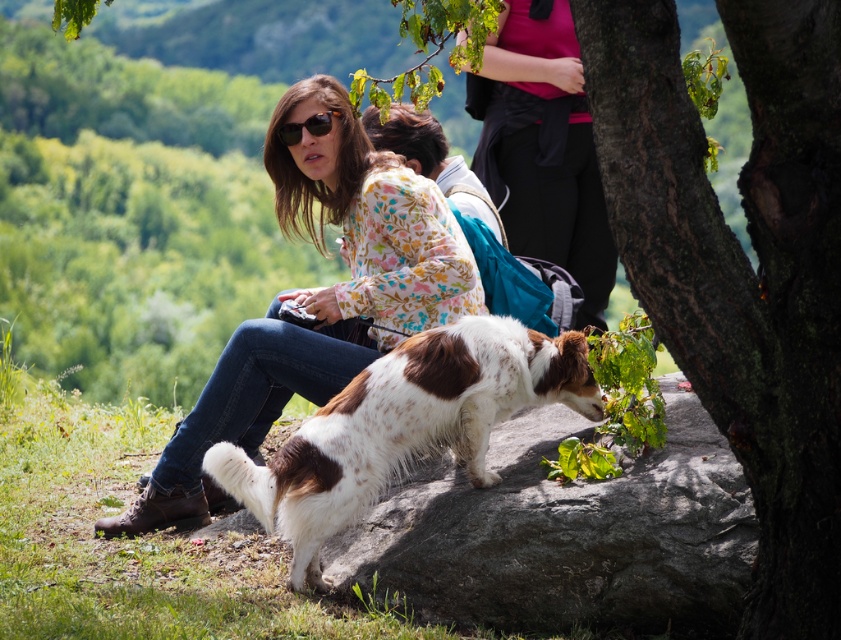
You are a photographer trying to capture a photo of the brown and white fur dog at center and the matte pink shirt at upper center. Based on their heights, which one will you need to adjust your camera angle to look up at?

The brown and white fur dog at center is shorter than the matte pink shirt at upper center, so you will need to look down at the dog and look up at the matte pink shirt at upper center.

You are a photographer trying to capture a clear shot of both the matte pink shirt at upper center and the matte black sunglasses at upper center. Since you want to focus on the shirt first, which object should you adjust your camera focus on first and why?

The matte pink shirt at upper center is much taller than the matte black sunglasses at upper center, so you should focus on the matte pink shirt at upper center first because it is larger and more prominent in the frame.